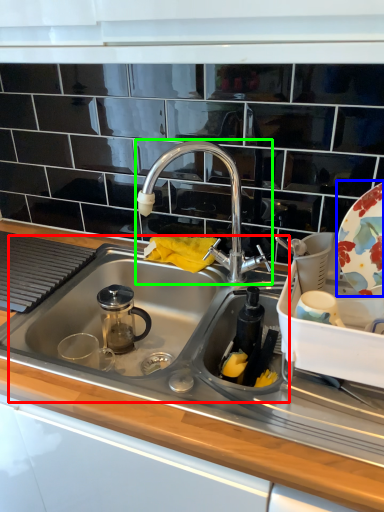
Question: Based on their relative distances, which object is nearer to sink (highlighted by a red box)? Choose from platter (highlighted by a blue box) and tap (highlighted by a green box).

Choices:
 (A) platter
 (B) tap

Answer: (B)